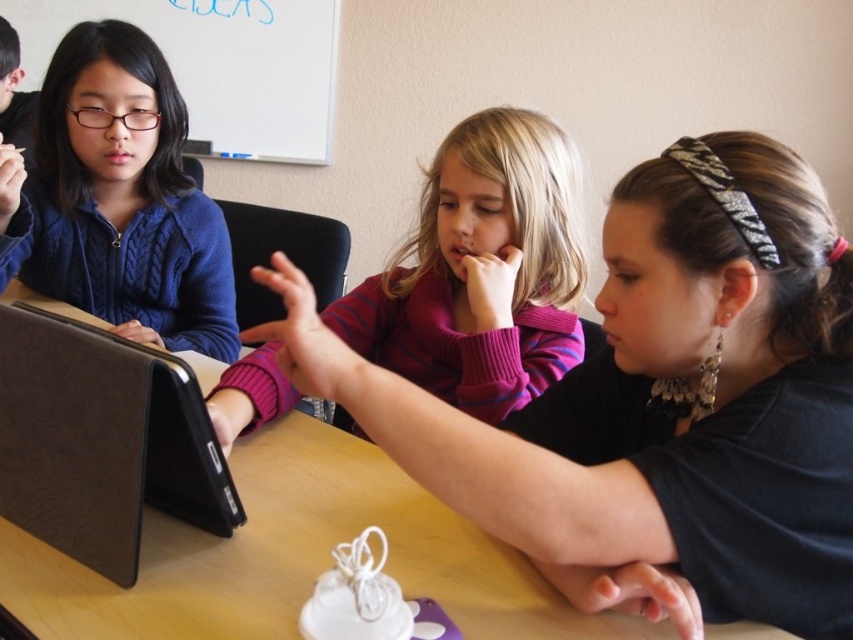
You are a student in the classroom and want to know which object is taller between the black matte shirt at center and the black leather laptop at left. Can you determine this based on their positions?

The black matte shirt at center is taller than the black leather laptop at left according to the description.

You are a photographer trying to capture a candid shot of the black matte shirt at center and the purple striped sweater at center. Since you want to ensure both are visible in the photo, which one should you focus on to keep both in the frame?

You should focus on the black matte shirt at center because it is in front of the purple striped sweater at center, so focusing on the front object will help keep both in the frame.